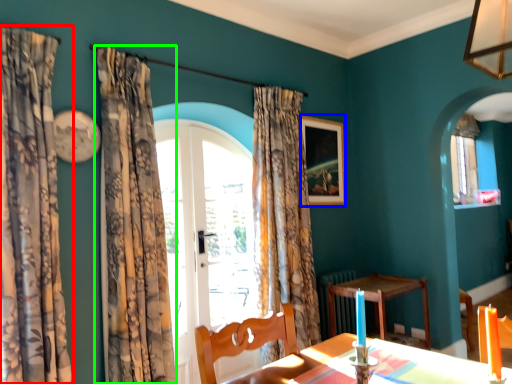
Question: Based on their relative distances, which object is nearer to curtain (highlighted by a red box)? Choose from picture frame (highlighted by a blue box) and curtain (highlighted by a green box).

Choices:
 (A) picture frame
 (B) curtain

Answer: (B)